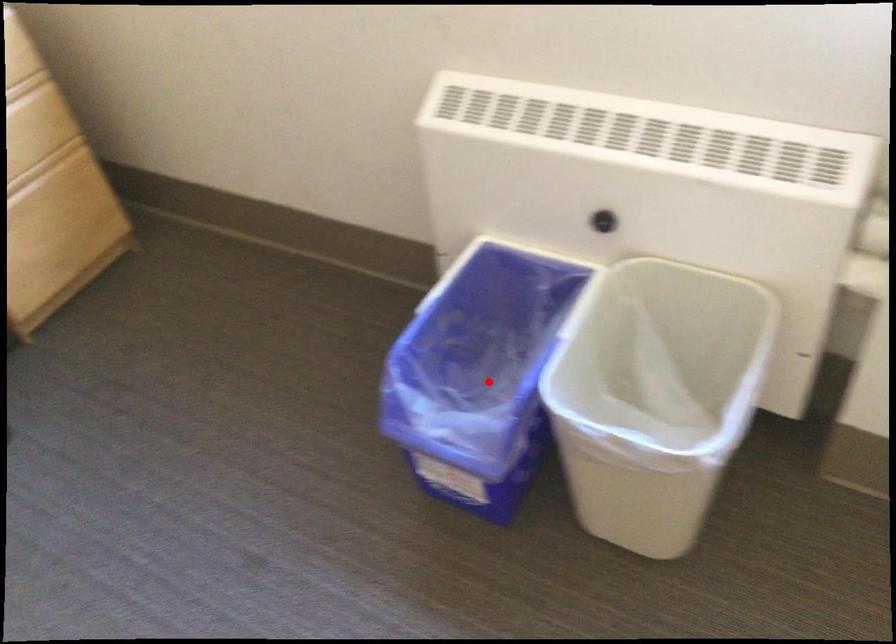
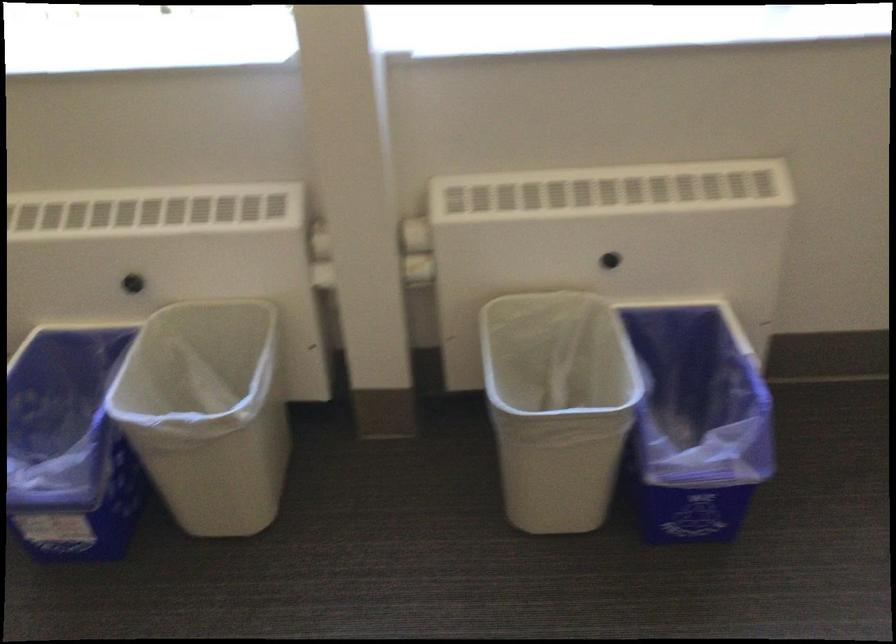
Question: I am providing you with two images of the same scene from different viewpoints. A red point is shown in image1. For the corresponding object point in image2, is it positioned nearer or farther from the camera?

Choices:
 (A) Nearer
 (B) Farther

Answer: (B)